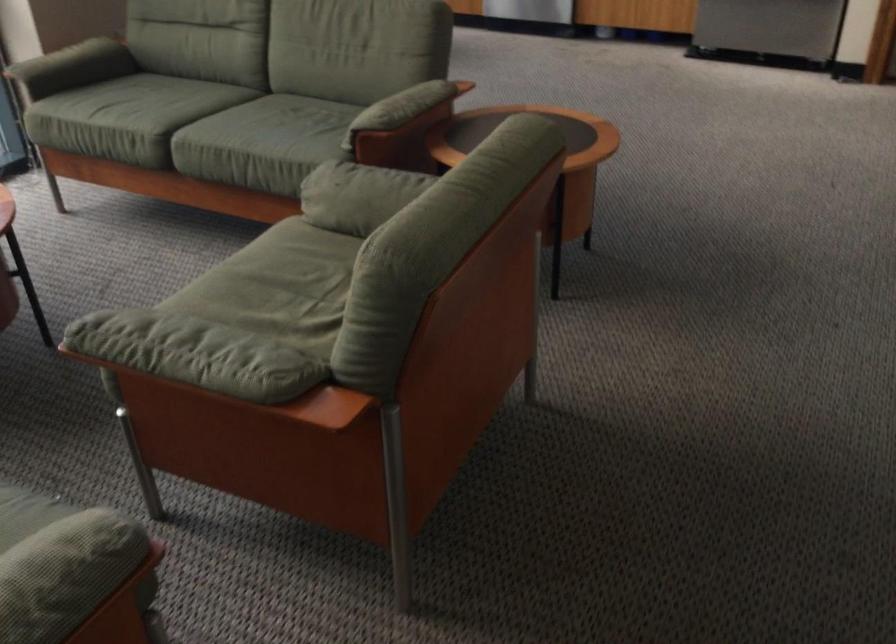
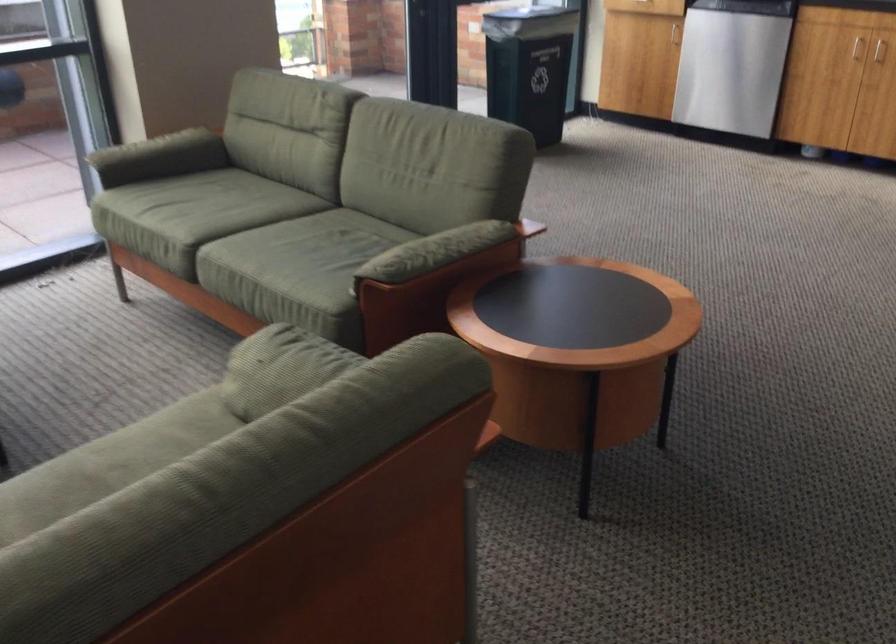
The images are taken continuously from a first-person perspective. In which direction are you moving?

The cameraman walked toward right, forward.